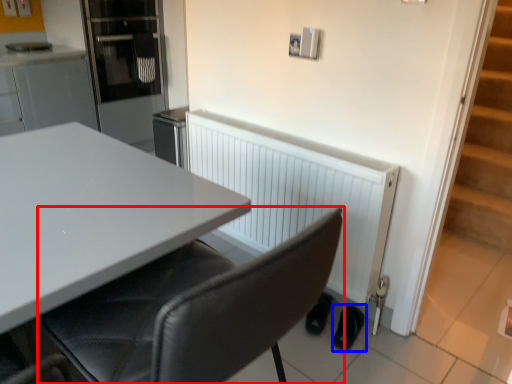
Question: Which object appears farthest to the camera in this image, chair (highlighted by a red box) or footwear (highlighted by a blue box)?

Choices:
 (A) chair
 (B) footwear

Answer: (B)